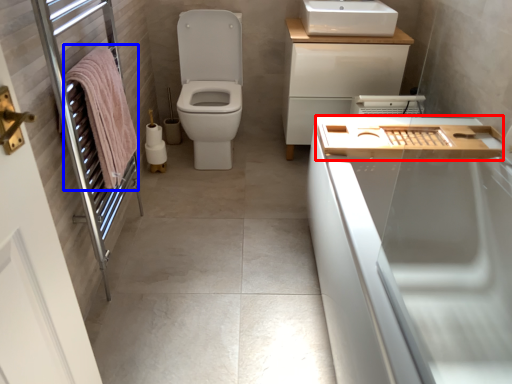
Question: Among these objects, which one is nearest to the camera, counter top (highlighted by a red box) or bath towel (highlighted by a blue box)?

Choices:
 (A) counter top
 (B) bath towel

Answer: (B)